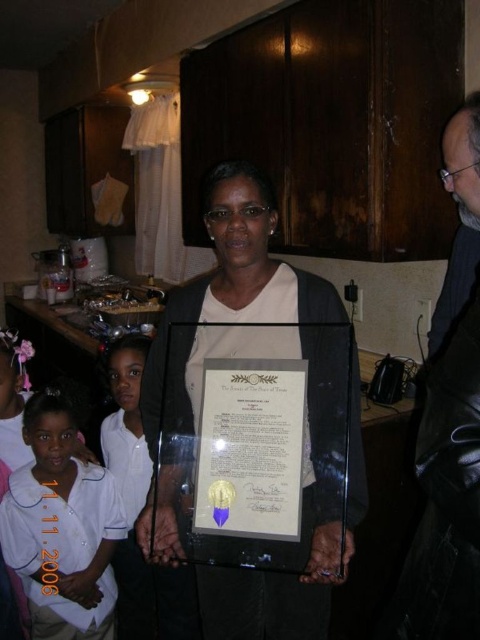
Is matte black frame at center wider than white cotton shirt at lower left?

Yes, matte black frame at center is wider than white cotton shirt at lower left.

Does matte black frame at center have a lesser width compared to white cotton shirt at lower left?

No, matte black frame at center is not thinner than white cotton shirt at lower left.

Which is behind, point (197, 388) or point (84, 561)?

The point (84, 561) is behind.

Locate an element on the screen. The image size is (480, 640). matte black frame at center is located at coordinates (308, 412).

Is white cotton shirt at lower left further to camera compared to matte gold certificate at center?

Yes, white cotton shirt at lower left is behind matte gold certificate at center.

Does white cotton shirt at lower left appear on the left side of matte gold certificate at center?

Indeed, white cotton shirt at lower left is positioned on the left side of matte gold certificate at center.

Who is more forward, (45, 593) or (244, 400)?

Answer: Point (244, 400)

Find the location of `white cotton shirt at lower left`. white cotton shirt at lower left is located at coordinates (61, 529).

Is matte black frame at center below matte gold certificate at center?

Incorrect, matte black frame at center is not positioned below matte gold certificate at center.

Describe the element at coordinates (308, 412) in the screenshot. The height and width of the screenshot is (640, 480). I see `matte black frame at center` at that location.

What do you see at coordinates (308, 412) in the screenshot?
I see `matte black frame at center` at bounding box center [308, 412].

What are the coordinates of `matte black frame at center` in the screenshot? It's located at (308, 412).